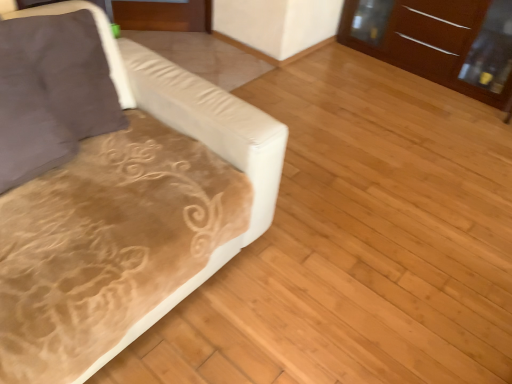
Question: Is suede-like brown pillow at left behind velvet beige couch at left?

Choices:
 (A) yes
 (B) no

Answer: (A)

Question: From the image's perspective, is suede-like brown pillow at left on velvet beige couch at left?

Choices:
 (A) no
 (B) yes

Answer: (B)

Question: From a real-world perspective, is suede-like brown pillow at left beneath velvet beige couch at left?

Choices:
 (A) yes
 (B) no

Answer: (B)

Question: Is the depth of suede-like brown pillow at left less than that of velvet beige couch at left?

Choices:
 (A) no
 (B) yes

Answer: (A)

Question: Can you confirm if suede-like brown pillow at left is shorter than velvet beige couch at left?

Choices:
 (A) yes
 (B) no

Answer: (A)

Question: Looking at their shapes, would you say brown glossy dresser at upper right is wider or thinner than suede-like brown pillow at left?

Choices:
 (A) thin
 (B) wide

Answer: (B)

Question: Based on their sizes in the image, would you say brown glossy dresser at upper right is bigger or smaller than suede-like brown pillow at left?

Choices:
 (A) small
 (B) big

Answer: (B)

Question: Would you say brown glossy dresser at upper right is inside or outside suede-like brown pillow at left?

Choices:
 (A) inside
 (B) outside

Answer: (B)

Question: Considering their positions, is brown glossy dresser at upper right located in front of or behind suede-like brown pillow at left?

Choices:
 (A) behind
 (B) front

Answer: (A)

Question: Does point (80, 48) appear closer or farther from the camera than point (194, 112)?

Choices:
 (A) closer
 (B) farther

Answer: (A)

Question: Is suede-like brown pillow at left taller or shorter than velvet beige couch at left?

Choices:
 (A) short
 (B) tall

Answer: (A)

Question: Looking at the image, does suede-like brown pillow at left seem bigger or smaller compared to velvet beige couch at left?

Choices:
 (A) big
 (B) small

Answer: (B)

Question: Is suede-like brown pillow at left inside or outside of velvet beige couch at left?

Choices:
 (A) inside
 (B) outside

Answer: (A)

Question: In terms of width, does velvet beige couch at left look wider or thinner when compared to brown glossy dresser at upper right?

Choices:
 (A) thin
 (B) wide

Answer: (B)

Question: From a real-world perspective, is velvet beige couch at left above or below brown glossy dresser at upper right?

Choices:
 (A) above
 (B) below

Answer: (A)